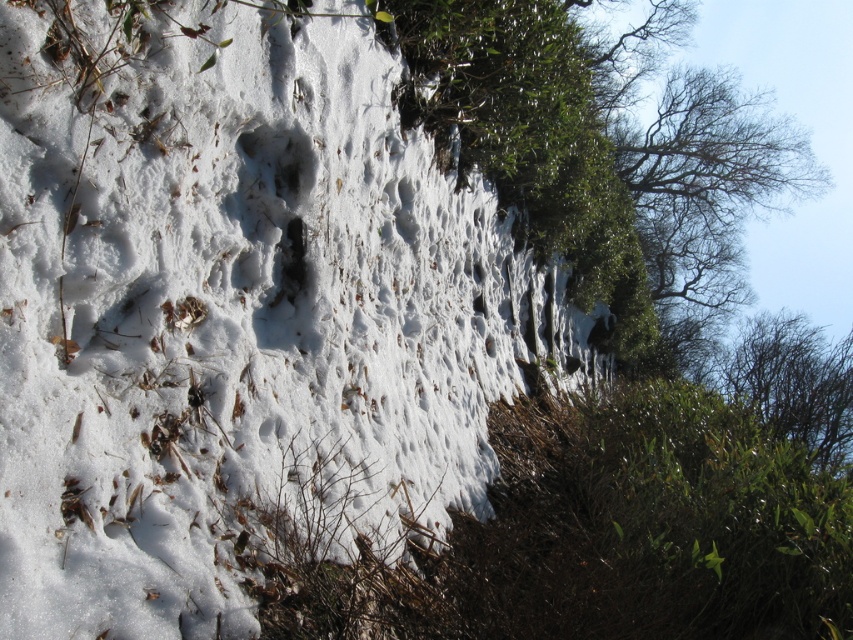
You are an explorer in the snowy landscape. You see the white fluffy snow at center and the green leafy tree at upper right. Which one is nearer to you?

The white fluffy snow at center is closer to the viewer than the green leafy tree at upper right, so the white fluffy snow at center is nearer to you.

In the scene shown: You are standing at the origin point of the coordinate system in the snowy landscape. You want to move towards the white fluffy snow at center. What are the coordinates you need to move to?

The coordinates to move towards the white fluffy snow at center are point (235,308).

You are an explorer trying to navigate through the snowy landscape. You see the white fluffy snow at center and the green leafy tree at upper right. Which one is taller?

The white fluffy snow at center has a lesser height compared to the green leafy tree at upper right, so the green leafy tree at upper right is taller.